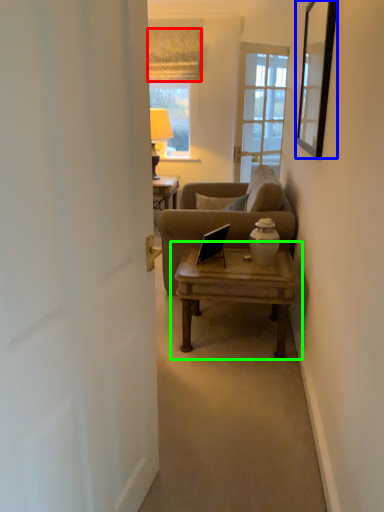
Question: Which is farther away from curtain (highlighted by a red box)? picture frame (highlighted by a blue box) or coffee table (highlighted by a green box)?

Choices:
 (A) picture frame
 (B) coffee table

Answer: (B)